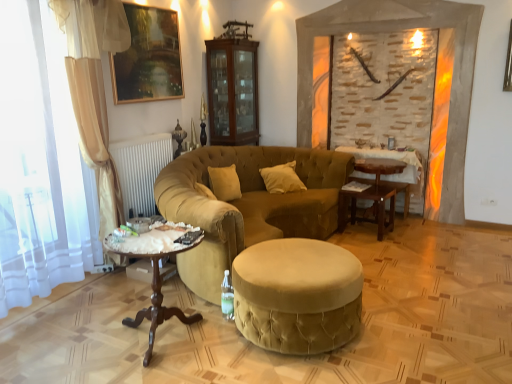
At what (x,y) coordinates should I click in order to perform the action: click on vacant space behind wooden polished table at lower left. Please return your answer as a coordinate pair (x, y). The height and width of the screenshot is (384, 512). Looking at the image, I should click on [x=163, y=299].